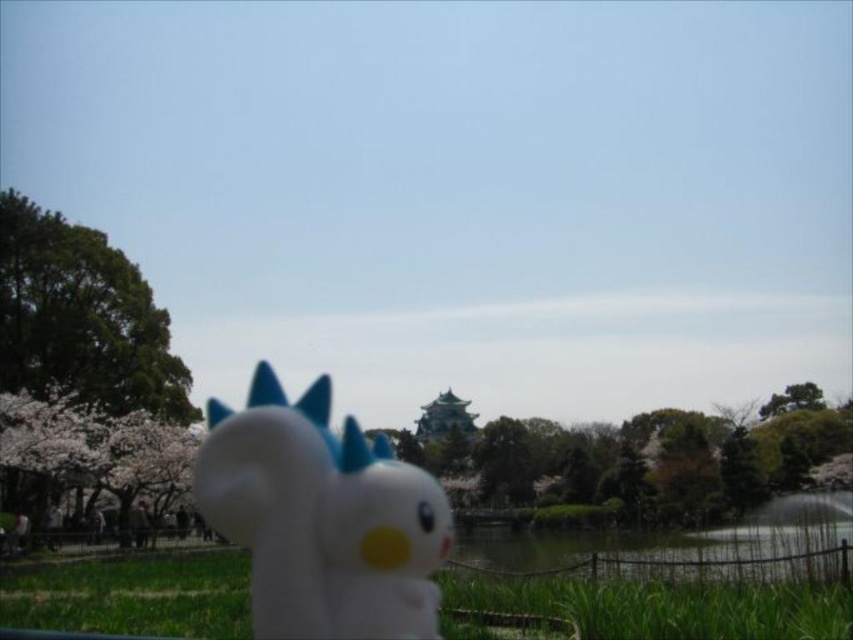
Question: Does white matte plush toy at center come behind green grass at lower center?

Choices:
 (A) yes
 (B) no

Answer: (B)

Question: Which object is farther from the camera taking this photo?

Choices:
 (A) white matte plush toy at center
 (B) green grass at lower center

Answer: (B)

Question: Is white matte plush toy at center to the right of green grass at lower center from the viewer's perspective?

Choices:
 (A) yes
 (B) no

Answer: (B)

Question: Which point is farther to the camera?

Choices:
 (A) white matte plush toy at center
 (B) green grass at lower center

Answer: (B)

Question: Can you confirm if white matte plush toy at center is smaller than green grass at lower center?

Choices:
 (A) yes
 (B) no

Answer: (B)